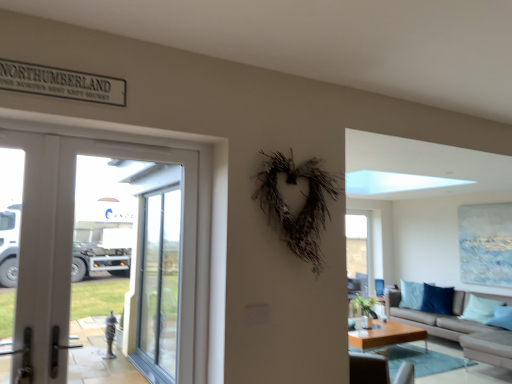
Question: Is point pos(456,321) positioned closer to the camera than point pos(365,243)?

Choices:
 (A) closer
 (B) farther

Answer: (A)

Question: From their relative heights in the image, would you say beige fabric couch at lower right is taller or shorter than transparent glass window at center?

Choices:
 (A) tall
 (B) short

Answer: (B)

Question: Which of these objects is positioned closest to the blue fabric armchair at right?

Choices:
 (A) beige fabric couch at lower right
 (B) white glossy screen door at left, the 1th screen door in the front-to-back sequence
 (C) transparent glass window at center
 (D) light brown wooden coffee table at lower center
 (E) light blue fabric pillow at lower right

Answer: (C)

Question: Estimate the real-world distances between objects in this image. Which object is closer to the white glossy door at left?

Choices:
 (A) transparent glass window at center
 (B) blue fabric armchair at right
 (C) white glossy screen door at left, the 1th screen door in the front-to-back sequence
 (D) beige fabric couch at lower right
 (E) light blue fabric pillow at lower right

Answer: (C)